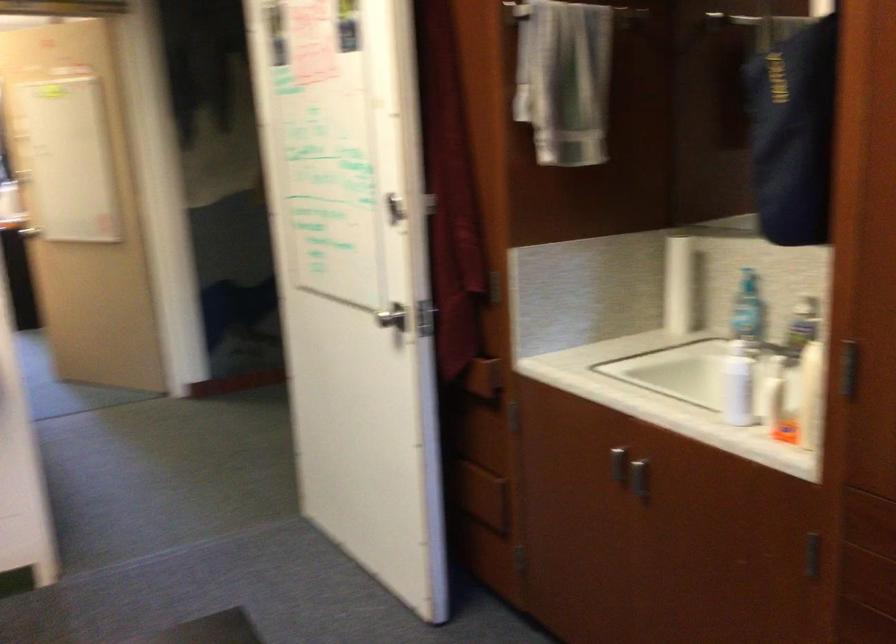
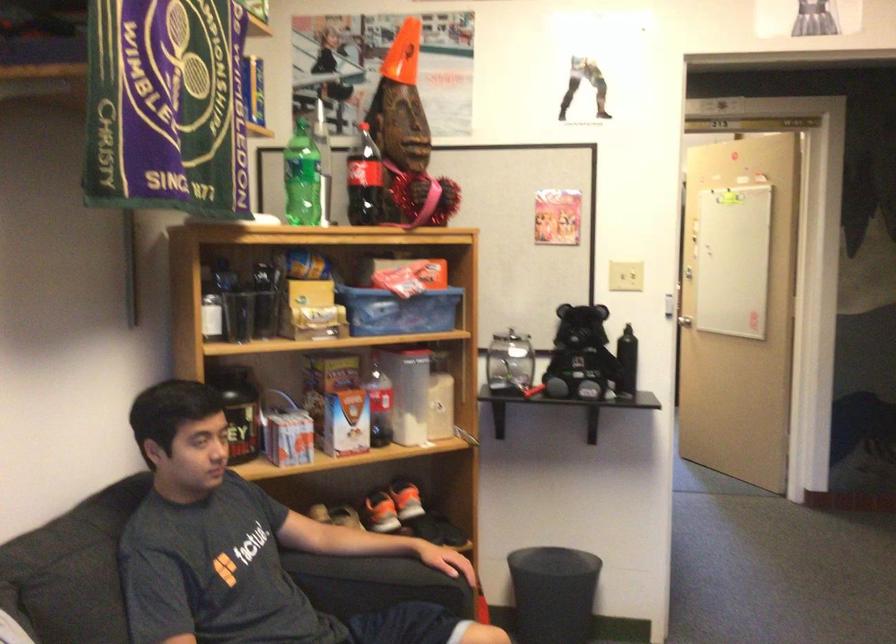
Question: The camera is either moving clockwise (left) or counter-clockwise (right) around the object. The first image is from the beginning of the video and the second image is from the end. Is the camera moving left or right when shooting the video?

Choices:
 (A) Left
 (B) Right

Answer: (B)